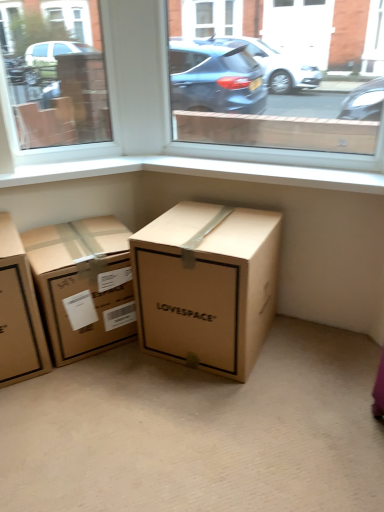
Question: Is white smooth window sill at upper center at the back of brown cardboard box at center, which is the 2th box in right-to-left order?

Choices:
 (A) yes
 (B) no

Answer: (B)

Question: Could you tell me if brown cardboard box at center, positioned as the second box in left-to-right order, is turned towards white smooth window sill at upper center?

Choices:
 (A) yes
 (B) no

Answer: (B)

Question: Is brown cardboard box at center, positioned as the second box in left-to-right order, to the left of white smooth window sill at upper center from the viewer's perspective?

Choices:
 (A) yes
 (B) no

Answer: (A)

Question: From a real-world perspective, does brown cardboard box at center, which is the 2th box in right-to-left order, sit lower than white smooth window sill at upper center?

Choices:
 (A) yes
 (B) no

Answer: (A)

Question: Can you confirm if brown cardboard box at center, positioned as the second box in left-to-right order, is taller than white smooth window sill at upper center?

Choices:
 (A) yes
 (B) no

Answer: (A)

Question: Does brown cardboard box at center, which is the 2th box in right-to-left order, come in front of white smooth window sill at upper center?

Choices:
 (A) no
 (B) yes

Answer: (B)

Question: From a real-world perspective, is brown cardboard box at left, the third box from the right, on transparent glass window at upper left, acting as the 1th window starting from the left?

Choices:
 (A) yes
 (B) no

Answer: (B)

Question: Is brown cardboard box at left, the first box viewed from the left, smaller than transparent glass window at upper left, acting as the 1th window starting from the left?

Choices:
 (A) no
 (B) yes

Answer: (A)

Question: Does brown cardboard box at left, the first box viewed from the left, have a larger size compared to transparent glass window at upper left, which ranks as the second window in right-to-left order?

Choices:
 (A) yes
 (B) no

Answer: (A)

Question: Is brown cardboard box at left, the first box viewed from the left, thinner than transparent glass window at upper left, which ranks as the second window in right-to-left order?

Choices:
 (A) yes
 (B) no

Answer: (B)

Question: Can transparent glass window at upper left, acting as the 1th window starting from the left, be found inside brown cardboard box at left, the third box from the right?

Choices:
 (A) yes
 (B) no

Answer: (B)

Question: From the image's perspective, is brown cardboard box at left, the first box viewed from the left, above transparent glass window at upper left, acting as the 1th window starting from the left?

Choices:
 (A) yes
 (B) no

Answer: (B)

Question: From the image's perspective, is transparent glass window at center, the 1th window in the right-to-left sequence, located above brown cardboard box at center, which is the 2th box in right-to-left order?

Choices:
 (A) no
 (B) yes

Answer: (B)